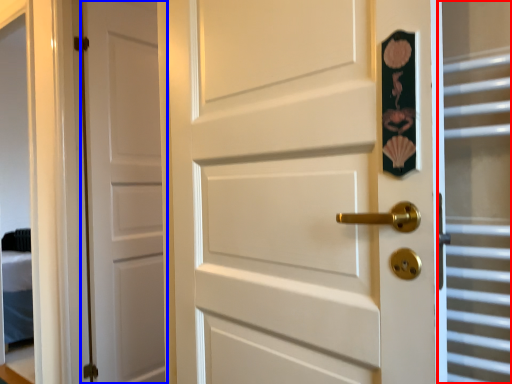
Question: Which object appears closest to the camera in this image, glass door (highlighted by a red box) or door (highlighted by a blue box)?

Choices:
 (A) glass door
 (B) door

Answer: (A)